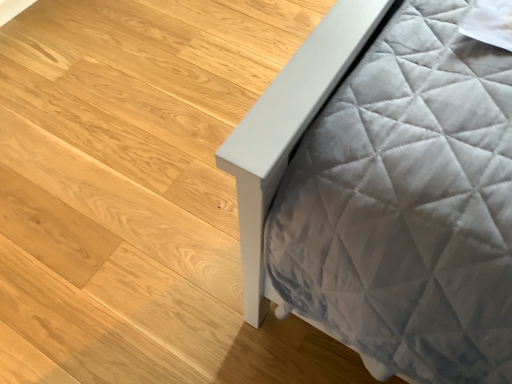
Locate an element on the screen. This screenshot has width=512, height=384. vacant space situated above gray quilted bed at upper right (from a real-world perspective) is located at coordinates (145, 150).